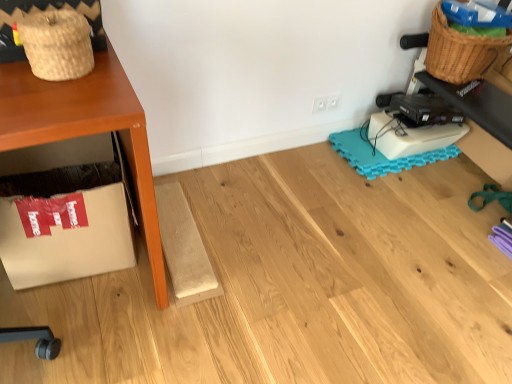
The image size is (512, 384). Describe the element at coordinates (57, 44) in the screenshot. I see `woven straw basket at upper left, which is the second basket in top-to-bottom order` at that location.

At what (x,y) coordinates should I click in order to perform the action: click on woven brown basket at upper right, which is the 1th basket in right-to-left order. Please return your answer as a coordinate pair (x, y). Looking at the image, I should click on (459, 52).

What do you see at coordinates (381, 154) in the screenshot? I see `teal foam mat at lower right` at bounding box center [381, 154].

This screenshot has width=512, height=384. I want to click on woven straw basket at upper left, marked as the first basket in a front-to-back arrangement, so click(57, 44).

Considering the positions of objects teal foam mat at lower right and woven brown basket at upper right, the first basket in the top-to-bottom sequence, in the image provided, who is more to the right, teal foam mat at lower right or woven brown basket at upper right, the first basket in the top-to-bottom sequence,?

woven brown basket at upper right, the first basket in the top-to-bottom sequence, is more to the right.

Is point (360, 169) closer to viewer compared to point (468, 46)?

No.

Does teal foam mat at lower right have a greater height compared to woven brown basket at upper right, positioned as the first basket in back-to-front order?

No.

Measure the distance from white cardboard box at lower left to woven brown basket at upper right, the first basket in the top-to-bottom sequence.

A distance of 1.58 meters exists between white cardboard box at lower left and woven brown basket at upper right, the first basket in the top-to-bottom sequence.

Is white cardboard box at lower left not near woven brown basket at upper right, which is the second basket in bottom-to-top order?

That's right, there is a large distance between white cardboard box at lower left and woven brown basket at upper right, which is the second basket in bottom-to-top order.

Is point (90, 172) closer to camera compared to point (436, 51)?

Yes, it is in front of point (436, 51).

From the image's perspective, is white cardboard box at lower left on top of woven brown basket at upper right, the first basket in the top-to-bottom sequence?

No, from the image's perspective, white cardboard box at lower left is not on top of woven brown basket at upper right, the first basket in the top-to-bottom sequence.

Does woven brown basket at upper right, which is the second basket from front to back, lie behind teal foam mat at lower right?

No, woven brown basket at upper right, which is the second basket from front to back, is closer to the camera.

Is point (456, 82) in front of point (377, 156)?

Yes, it is.

Which is correct: woven brown basket at upper right, which is the second basket in bottom-to-top order, is inside teal foam mat at lower right, or outside of it?

woven brown basket at upper right, which is the second basket in bottom-to-top order, cannot be found inside teal foam mat at lower right.

Between woven brown basket at upper right, which is the second basket in bottom-to-top order, and teal foam mat at lower right, which one has larger size?

woven brown basket at upper right, which is the second basket in bottom-to-top order.

Can you tell me how much woven brown basket at upper right, which is the second basket from front to back, and woven straw basket at upper left, the 2th basket from the back, differ in facing direction?

The angular difference between woven brown basket at upper right, which is the second basket from front to back, and woven straw basket at upper left, the 2th basket from the back, is 89.4 degrees.

Consider the image. Is woven brown basket at upper right, the second basket in the left-to-right sequence, to the left of woven straw basket at upper left, which is the second basket in top-to-bottom order, from the viewer's perspective?

In fact, woven brown basket at upper right, the second basket in the left-to-right sequence, is to the right of woven straw basket at upper left, which is the second basket in top-to-bottom order.

From a real-world perspective, which is physically below, woven brown basket at upper right, which is the 1th basket in right-to-left order, or woven straw basket at upper left, the 2th basket from the back?

In real-world perspective, woven brown basket at upper right, which is the 1th basket in right-to-left order, is lower.

You are a GUI agent. You are given a task and a screenshot of the screen. Output one action in this format:
    pyautogui.click(x=<x>, y=<y>)
    Task: Click on the basket on the right of woven straw basket at upper left, marked as the first basket in a front-to-back arrangement
    Image resolution: width=512 pixels, height=384 pixels.
    Given the screenshot: What is the action you would take?
    pyautogui.click(x=459, y=52)

Find the location of a particular element. The height and width of the screenshot is (384, 512). cardboard box that is on the left side of woven straw basket at upper left, which is counted as the second basket, starting from the right is located at coordinates (64, 224).

Can we say woven straw basket at upper left, the 2th basket from the back, lies outside white cardboard box at lower left?

woven straw basket at upper left, the 2th basket from the back, is positioned outside white cardboard box at lower left.

Based on the photo, measure the distance from white cardboard box at lower left to woven straw basket at upper left, the 2th basket from the back.

white cardboard box at lower left and woven straw basket at upper left, the 2th basket from the back, are 55.09 centimeters apart from each other.

From the image's perspective, does white cardboard box at lower left appear lower than woven straw basket at upper left, the 1th basket from the bottom?

Yes, from the image's perspective, white cardboard box at lower left is beneath woven straw basket at upper left, the 1th basket from the bottom.

Who is bigger, white cardboard box at lower left or woven straw basket at upper left, which is the first basket from left to right?

white cardboard box at lower left is bigger.

Can you tell me how much white cardboard box at lower left and woven straw basket at upper left, which is the first basket from left to right, differ in facing direction?

There is a 5.49-degree angle between the facing directions of white cardboard box at lower left and woven straw basket at upper left, which is the first basket from left to right.

Is teal foam mat at lower right taller or shorter than woven straw basket at upper left, the 1th basket from the bottom?

In the image, teal foam mat at lower right appears to be shorter than woven straw basket at upper left, the 1th basket from the bottom.

You are a GUI agent. You are given a task and a screenshot of the screen. Output one action in this format:
    pyautogui.click(x=<x>, y=<y>)
    Task: Click on the mat that is on the right side of woven straw basket at upper left, which is counted as the second basket, starting from the right
    The height and width of the screenshot is (384, 512).
    Given the screenshot: What is the action you would take?
    pyautogui.click(x=381, y=154)

Which is more to the right, teal foam mat at lower right or woven straw basket at upper left, which is the second basket in top-to-bottom order?

Positioned to the right is teal foam mat at lower right.

How different are the orientations of teal foam mat at lower right and woven straw basket at upper left, which is the second basket in top-to-bottom order, in degrees?

The facing directions of teal foam mat at lower right and woven straw basket at upper left, which is the second basket in top-to-bottom order, are 90.8 degrees apart.

Locate an element on the screen. mat lying behind the woven brown basket at upper right, positioned as the first basket in back-to-front order is located at coordinates (381, 154).

At what (x,y) coordinates should I click in order to perform the action: click on cardboard box that appears below the woven brown basket at upper right, which is the 1th basket in right-to-left order (from the image's perspective). Please return your answer as a coordinate pair (x, y). Looking at the image, I should click on (64, 224).

Based on their spatial positions, is teal foam mat at lower right or woven brown basket at upper right, which is the second basket from front to back, further from woven straw basket at upper left, which is the first basket from left to right?

The object further to woven straw basket at upper left, which is the first basket from left to right, is woven brown basket at upper right, which is the second basket from front to back.

From the image, which object appears to be farther from white cardboard box at lower left, woven straw basket at upper left, which is the second basket in top-to-bottom order, or woven brown basket at upper right, positioned as the first basket in back-to-front order?

woven brown basket at upper right, positioned as the first basket in back-to-front order, lies further to white cardboard box at lower left than the other object.

Which object lies nearer to the anchor point woven brown basket at upper right, which is the 1th basket in right-to-left order, teal foam mat at lower right or white cardboard box at lower left?

Among the two, teal foam mat at lower right is located nearer to woven brown basket at upper right, which is the 1th basket in right-to-left order.

Based on their spatial positions, is woven brown basket at upper right, which is the second basket from front to back, or woven straw basket at upper left, marked as the first basket in a front-to-back arrangement, closer to white cardboard box at lower left?

woven straw basket at upper left, marked as the first basket in a front-to-back arrangement, is closer to white cardboard box at lower left.

Based on their spatial positions, is woven straw basket at upper left, which is the first basket from left to right, or white cardboard box at lower left closer to teal foam mat at lower right?

white cardboard box at lower left.

When comparing their distances from white cardboard box at lower left, does teal foam mat at lower right or woven straw basket at upper left, the 1th basket from the bottom, seem closer?

woven straw basket at upper left, the 1th basket from the bottom.

From the image, which object appears to be farther from teal foam mat at lower right, woven brown basket at upper right, the second basket in the left-to-right sequence, or woven straw basket at upper left, which is counted as the second basket, starting from the right?

woven straw basket at upper left, which is counted as the second basket, starting from the right, is positioned further to the anchor teal foam mat at lower right.

From the image, which object appears to be nearer to woven straw basket at upper left, which is counted as the second basket, starting from the right, woven brown basket at upper right, positioned as the first basket in back-to-front order, or teal foam mat at lower right?

teal foam mat at lower right is closer to woven straw basket at upper left, which is counted as the second basket, starting from the right.

You are a GUI agent. You are given a task and a screenshot of the screen. Output one action in this format:
    pyautogui.click(x=<x>, y=<y>)
    Task: Click on the mat between white cardboard box at lower left and woven brown basket at upper right, which is the 1th basket in right-to-left order, from left to right
    This screenshot has height=384, width=512.
    Given the screenshot: What is the action you would take?
    coord(381,154)

Where is `basket between white cardboard box at lower left and teal foam mat at lower right`? basket between white cardboard box at lower left and teal foam mat at lower right is located at coordinates (57, 44).

You are a GUI agent. You are given a task and a screenshot of the screen. Output one action in this format:
    pyautogui.click(x=<x>, y=<y>)
    Task: Click on the mat between woven straw basket at upper left, which is the first basket from left to right, and woven brown basket at upper right, which is the 1th basket in right-to-left order, in the horizontal direction
    This screenshot has width=512, height=384.
    Given the screenshot: What is the action you would take?
    pyautogui.click(x=381, y=154)

At what (x,y) coordinates should I click in order to perform the action: click on basket between white cardboard box at lower left and woven brown basket at upper right, the second basket in the left-to-right sequence, in the horizontal direction. Please return your answer as a coordinate pair (x, y). This screenshot has height=384, width=512. Looking at the image, I should click on (57, 44).